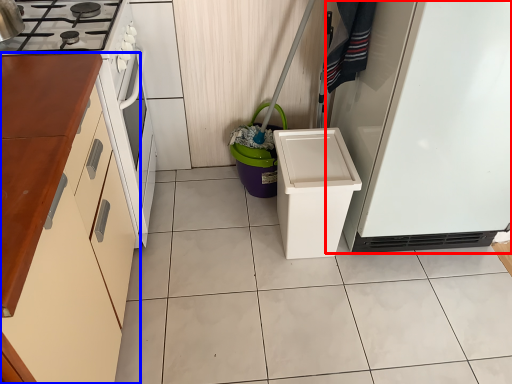
Question: Which object is further to the camera taking this photo, refrigerator (highlighted by a red box) or cabinetry (highlighted by a blue box)?

Choices:
 (A) refrigerator
 (B) cabinetry

Answer: (A)